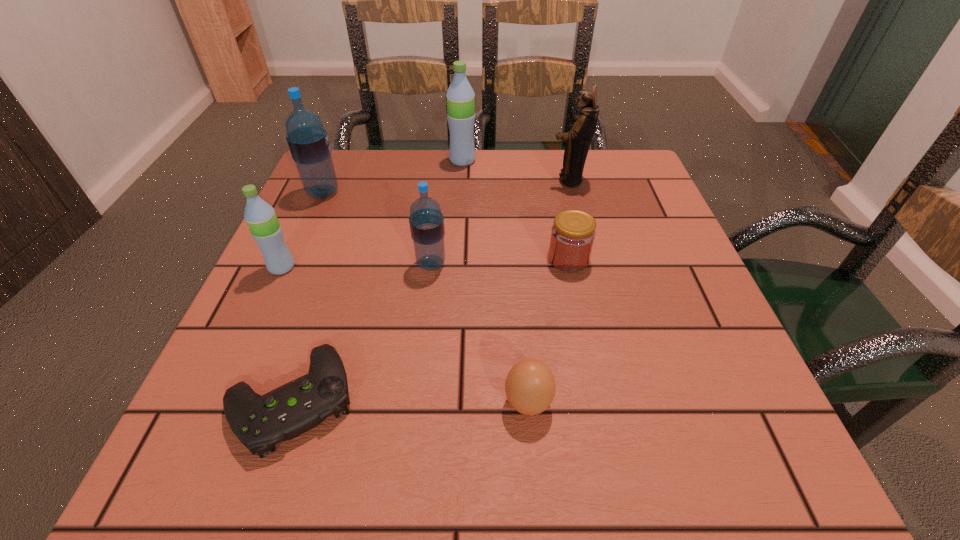
Where is `the farthest water bottle`? This screenshot has height=540, width=960. the farthest water bottle is located at coordinates (460, 96).

Identify the location of the farther green water bottle. This screenshot has height=540, width=960. pyautogui.click(x=460, y=96).

Find the location of a particular element. the bigger blue water bottle is located at coordinates tap(308, 142).

At what (x,y) coordinates should I click in order to perform the action: click on the farther blue water bottle. Please return your answer as a coordinate pair (x, y). Looking at the image, I should click on (308, 142).

This screenshot has width=960, height=540. I want to click on figurine, so click(x=578, y=140).

You are a GUI agent. You are given a task and a screenshot of the screen. Output one action in this format:
    pyautogui.click(x=<x>, y=<y>)
    Task: Click on the nearer blue water bottle
    The image size is (960, 540).
    Given the screenshot: What is the action you would take?
    pyautogui.click(x=426, y=221)

At what (x,y) coordinates should I click in order to perform the action: click on the smaller blue water bottle. Please return your answer as a coordinate pair (x, y). The width and height of the screenshot is (960, 540). Looking at the image, I should click on (426, 221).

You are a GUI agent. You are given a task and a screenshot of the screen. Output one action in this format:
    pyautogui.click(x=<x>, y=<y>)
    Task: Click on the left green water bottle
    The image size is (960, 540).
    Given the screenshot: What is the action you would take?
    pyautogui.click(x=260, y=217)

You are a GUI agent. You are given a task and a screenshot of the screen. Output one action in this format:
    pyautogui.click(x=<x>, y=<y>)
    Task: Click on the smaller green water bottle
    The image size is (960, 540).
    Given the screenshot: What is the action you would take?
    pyautogui.click(x=260, y=217)

Where is `red jam`? The height and width of the screenshot is (540, 960). red jam is located at coordinates (572, 235).